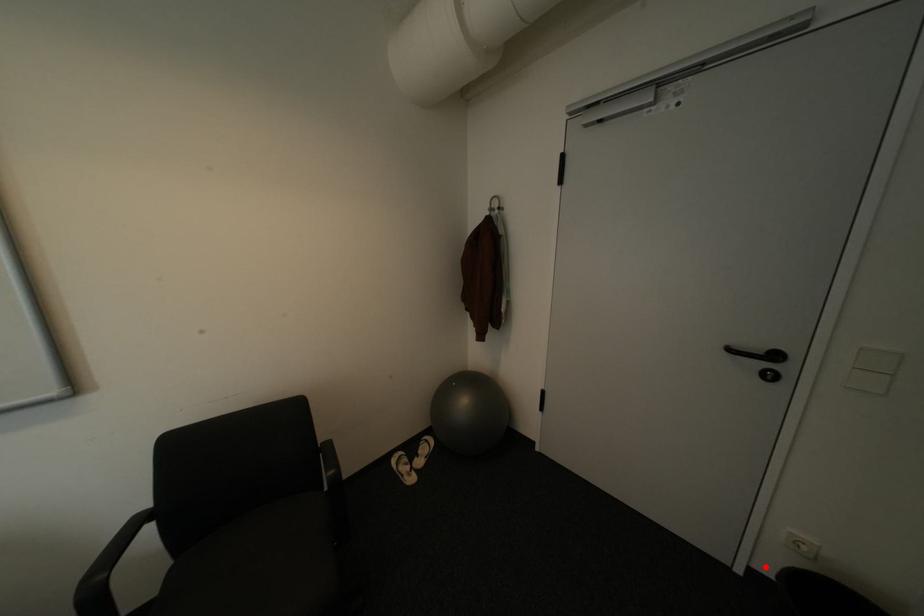
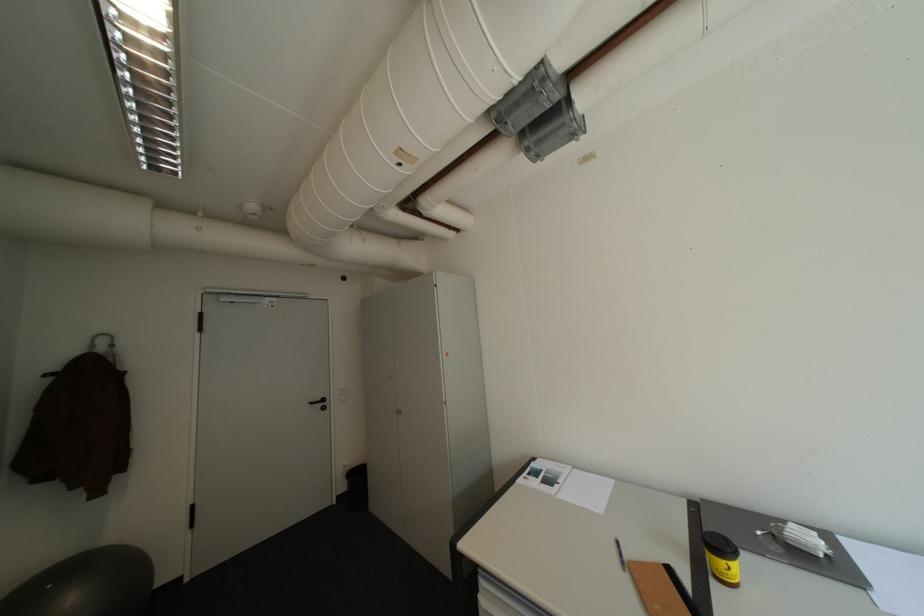
Locate, in the second image, the point that corresponds to the highlighted location in the first image.

(347, 493)